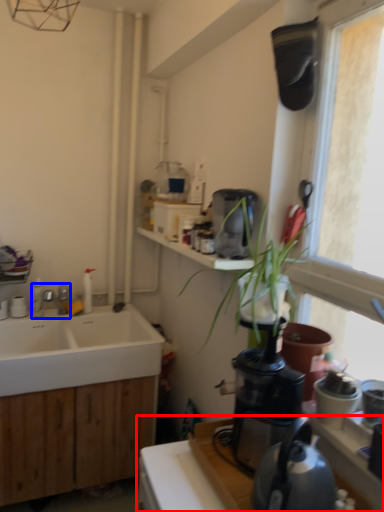
Question: Which point is closer to the camera, countertop (highlighted by a red box) or tap (highlighted by a blue box)?

Choices:
 (A) countertop
 (B) tap

Answer: (A)